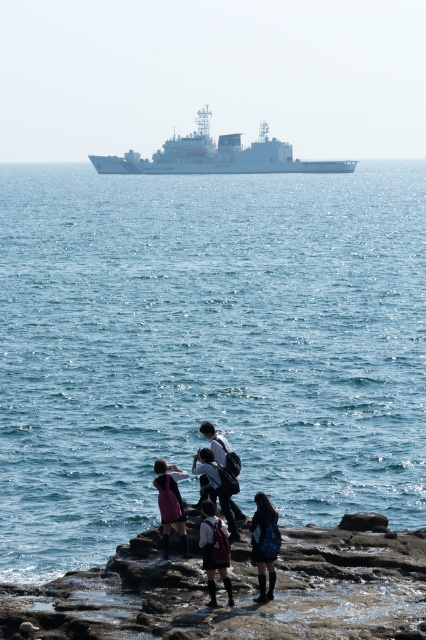
Consider the image. Does pink fabric dress at lower center lie in front of white cotton shirt at center?

That is True.

Based on the photo, is the position of pink fabric dress at lower center more distant than that of white cotton shirt at center?

No, it is not.

Where is `pink fabric dress at lower center`? The height and width of the screenshot is (640, 426). pink fabric dress at lower center is located at coordinates (173, 499).

Between dark blue denim skirt at center and white cotton shirt at center, which one has more height?

white cotton shirt at center is taller.

Does dark blue denim skirt at center come in front of white cotton shirt at center?

Yes.

Is point (227, 576) closer to camera compared to point (212, 422)?

Yes, point (227, 576) is closer to viewer.

This screenshot has height=640, width=426. Find the location of `dark blue denim skirt at center`. dark blue denim skirt at center is located at coordinates (213, 548).

Does rugged stone coast at lower center appear over white cotton shirt at center?

Actually, rugged stone coast at lower center is below white cotton shirt at center.

Who is taller, rugged stone coast at lower center or white cotton shirt at center?

Standing taller between the two is white cotton shirt at center.

Locate an element on the screen. rugged stone coast at lower center is located at coordinates (236, 592).

The width and height of the screenshot is (426, 640). Find the location of `rugged stone coast at lower center`. rugged stone coast at lower center is located at coordinates (236, 592).